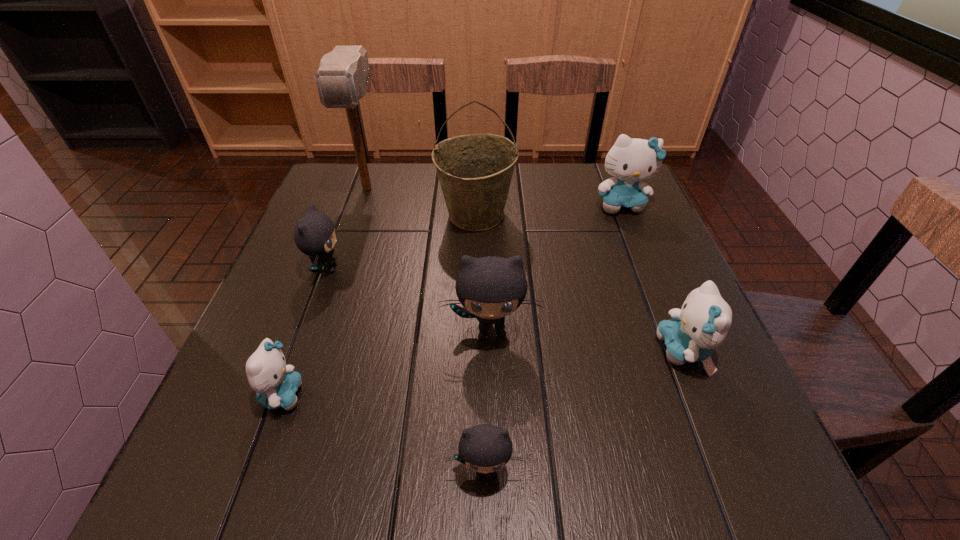
I want to click on gray kitten that is the second closest to the second nearest gray kitten, so click(x=314, y=234).

Image resolution: width=960 pixels, height=540 pixels. Identify the location of vacant region that satisfies the following two spatial constraints: 1. on the front-facing side of the biggest gray kitten; 2. on the face of the leftmost blue kitten. (492, 395).

Identify the location of free spot that satisfies the following two spatial constraints: 1. on the front-facing side of the biggest gray kitten; 2. on the face of the smallest blue kitten. (492, 395).

The image size is (960, 540). What are the coordinates of `vacant space that satisfies the following two spatial constraints: 1. on the face of the second biggest blue kitten; 2. on the front-facing side of the nearest gray kitten` in the screenshot? It's located at (732, 470).